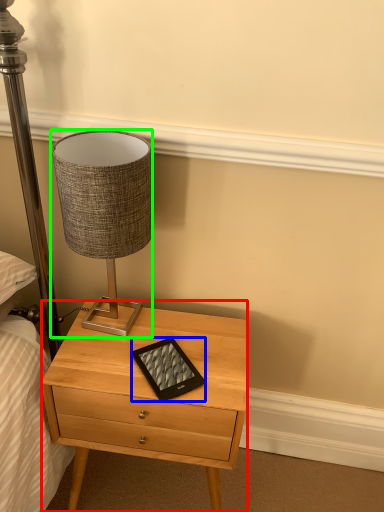
Question: Which is farther away from nightstand (highlighted by a red box)? tablet computer (highlighted by a blue box) or lamp (highlighted by a green box)?

Choices:
 (A) tablet computer
 (B) lamp

Answer: (B)